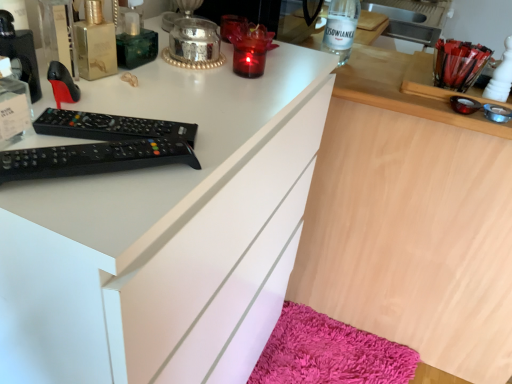
This screenshot has width=512, height=384. In order to click on free spot in front of clear glass bottle at upper center in this screenshot , I will do `click(366, 78)`.